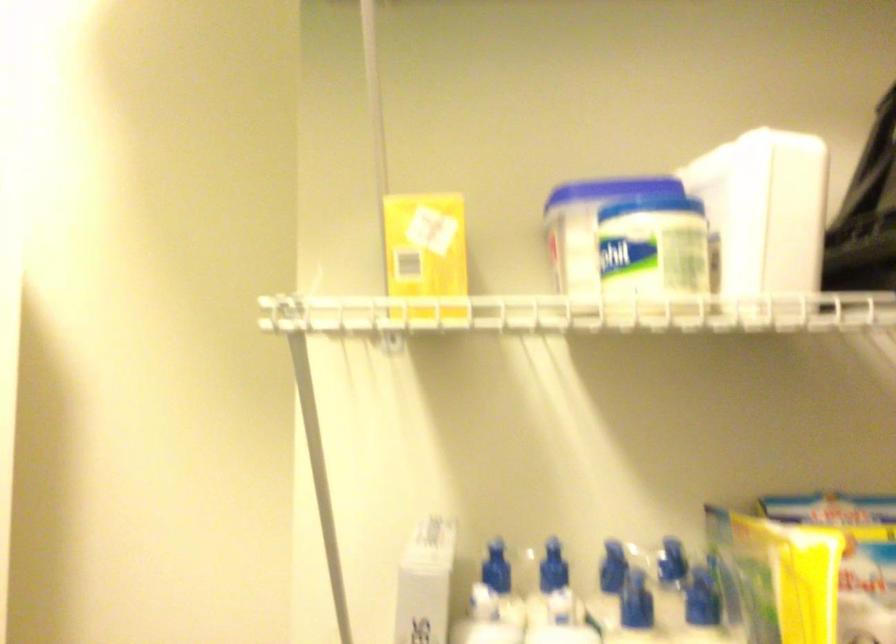
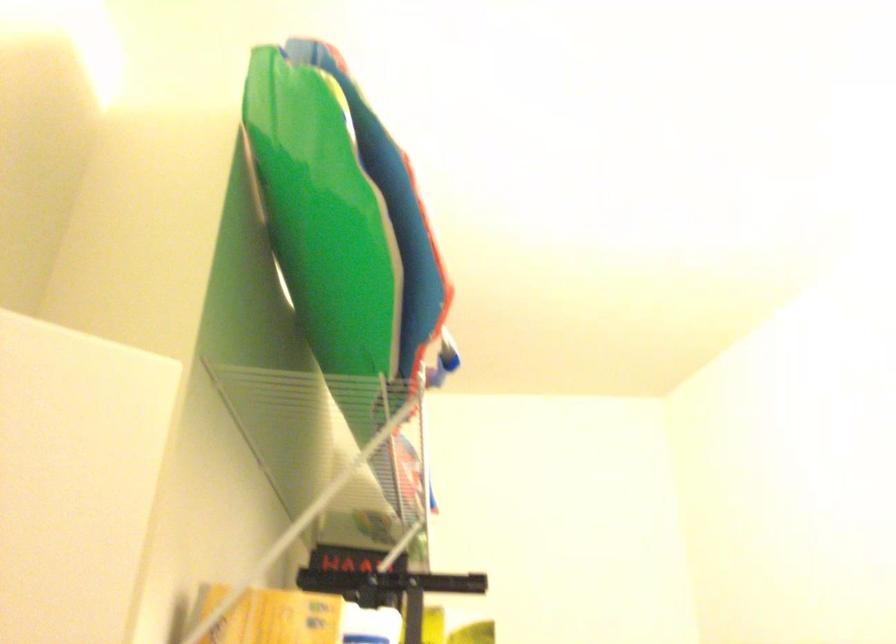
In the second image, find the point that corresponds to pixel 424 236 in the first image.

(271, 617)